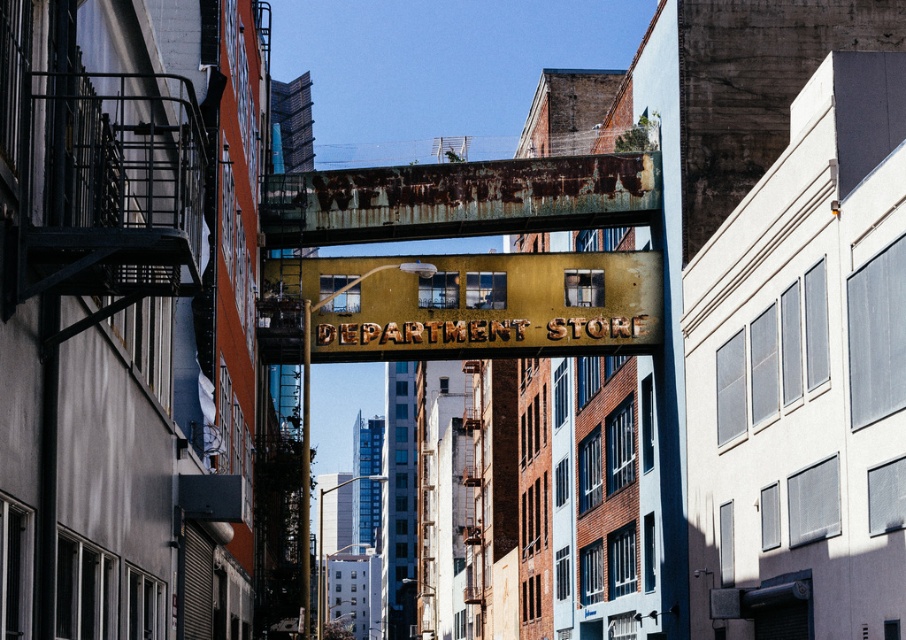
In the scene shown: You are a city planner assessing the bridge for renovation. You notice two signs on the bridge. The first is the rusty gold sign at center and the second is the rusty metal sign at center. Which sign has a greater width?

The rusty gold sign at center has a greater width than the rusty metal sign at center, as stated in the description.

You are a maintenance worker assigned to inspect the signs on the bridge. You have a ladder that is 2 meters long. Can you safely reach both the rusty gold sign at center and the rusty metal sign at center with your ladder without moving it?

The distance between the rusty gold sign at center and the rusty metal sign at center is 2.74 meters. Since your ladder is only 2 meters long, you cannot safely reach both signs without moving the ladder because the distance exceeds the ladder length.

You are standing on the weathered metal pedestrian bridge between two buildings. There is a point marked at coordinates (463, 305). What object is located at that point?

The point at coordinates (463, 305) corresponds to the rusty gold sign at center.